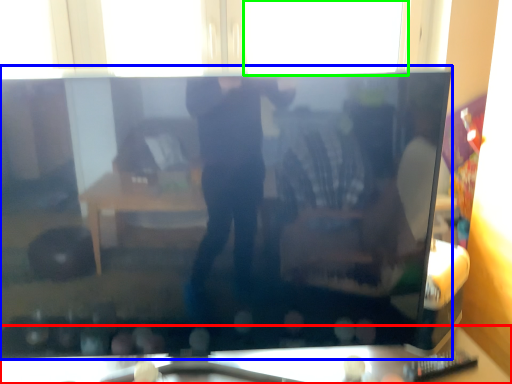
Question: Considering the real-world distances, which object is closest to furniture (highlighted by a red box)? television (highlighted by a blue box) or window (highlighted by a green box).

Choices:
 (A) television
 (B) window

Answer: (A)